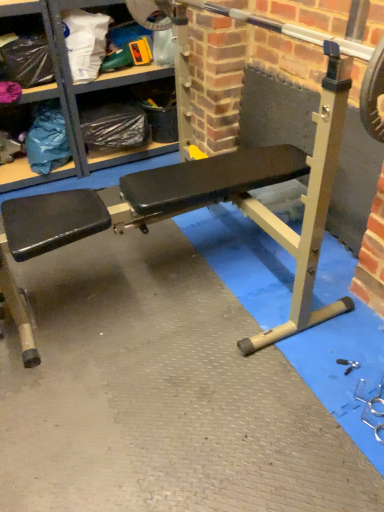
Question: From the image's perspective, is matte plastic shelf at upper left located beneath metallic silver barbell at center?

Choices:
 (A) yes
 (B) no

Answer: (B)

Question: From the image's perspective, is matte plastic shelf at upper left located above metallic silver barbell at center?

Choices:
 (A) no
 (B) yes

Answer: (B)

Question: Is matte plastic shelf at upper left bigger than metallic silver barbell at center?

Choices:
 (A) yes
 (B) no

Answer: (A)

Question: From a real-world perspective, is matte plastic shelf at upper left physically above metallic silver barbell at center?

Choices:
 (A) yes
 (B) no

Answer: (B)

Question: Is matte plastic shelf at upper left with metallic silver barbell at center?

Choices:
 (A) no
 (B) yes

Answer: (A)

Question: Would you say matte plastic shelf at upper left contains metallic silver barbell at center?

Choices:
 (A) yes
 (B) no

Answer: (B)

Question: Is metallic silver barbell at center positioned with its back to matte plastic shelf at upper left?

Choices:
 (A) no
 (B) yes

Answer: (A)

Question: Is metallic silver barbell at center not within matte plastic shelf at upper left?

Choices:
 (A) no
 (B) yes

Answer: (B)

Question: Considering the relative positions of metallic silver barbell at center and matte plastic shelf at upper left in the image provided, is metallic silver barbell at center to the right of matte plastic shelf at upper left from the viewer's perspective?

Choices:
 (A) no
 (B) yes

Answer: (B)

Question: Is metallic silver barbell at center wider than matte plastic shelf at upper left?

Choices:
 (A) yes
 (B) no

Answer: (B)

Question: Considering the relative sizes of metallic silver barbell at center and matte plastic shelf at upper left in the image provided, is metallic silver barbell at center taller than matte plastic shelf at upper left?

Choices:
 (A) yes
 (B) no

Answer: (B)

Question: Is metallic silver barbell at center further to camera compared to matte plastic shelf at upper left?

Choices:
 (A) yes
 (B) no

Answer: (B)

Question: Considering the positions of matte plastic shelf at upper left and metallic silver barbell at center in the image, is matte plastic shelf at upper left bigger or smaller than metallic silver barbell at center?

Choices:
 (A) big
 (B) small

Answer: (A)